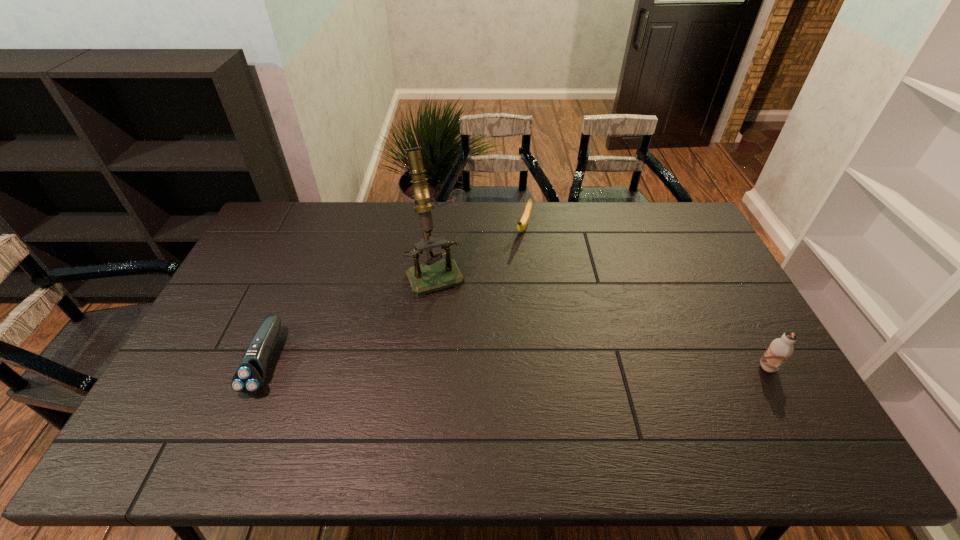
Image resolution: width=960 pixels, height=540 pixels. What are the coordinates of `empty location between the banana and the rightmost object` in the screenshot? It's located at point(646,298).

Identify the location of vacant area between the farthest object and the tallest object. This screenshot has width=960, height=540. (481, 250).

Find the location of a particular element. the third closest object relative to the farthest object is located at coordinates (250, 376).

This screenshot has height=540, width=960. What are the coordinates of `object that stands as the second closest to the leftmost object` in the screenshot? It's located at (522, 224).

Where is `vacant space that satisfies the following two spatial constraints: 1. on the head of the chocolate milk; 2. on the right side of the electric shaver`? The height and width of the screenshot is (540, 960). vacant space that satisfies the following two spatial constraints: 1. on the head of the chocolate milk; 2. on the right side of the electric shaver is located at coordinates (263, 367).